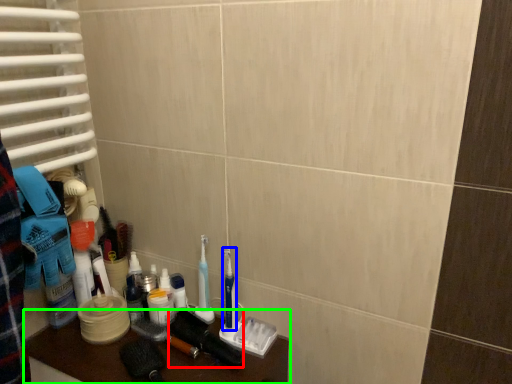
Question: Which object is the closest to the brush (highlighted by a red box)? Choose among these: toothbrush (highlighted by a blue box) or furniture (highlighted by a green box).

Choices:
 (A) toothbrush
 (B) furniture

Answer: (A)